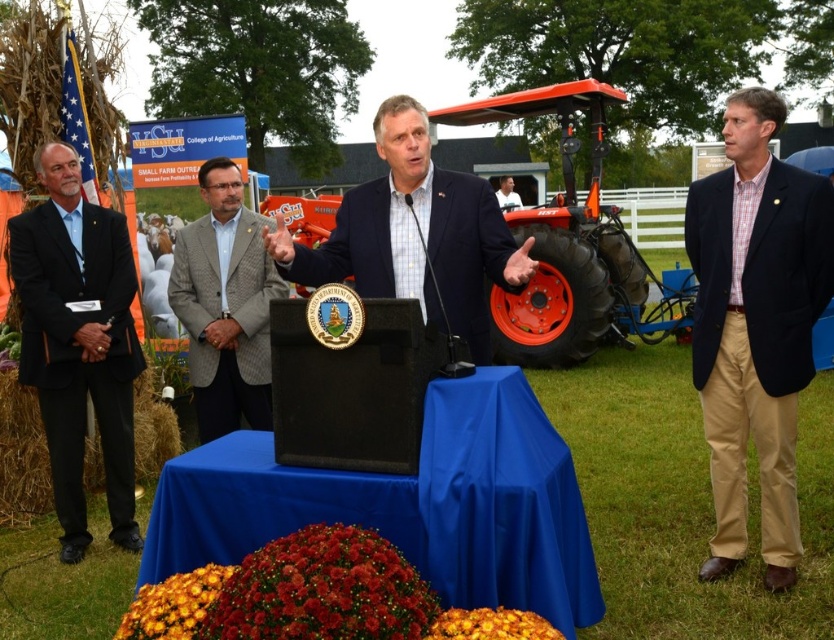
You are attending a press conference at Virginia State University and notice two people in the front row. The dark blue suit at left and the white shirt at center are both standing. Which person is shorter?

The dark blue suit at left is shorter than the white shirt at center.